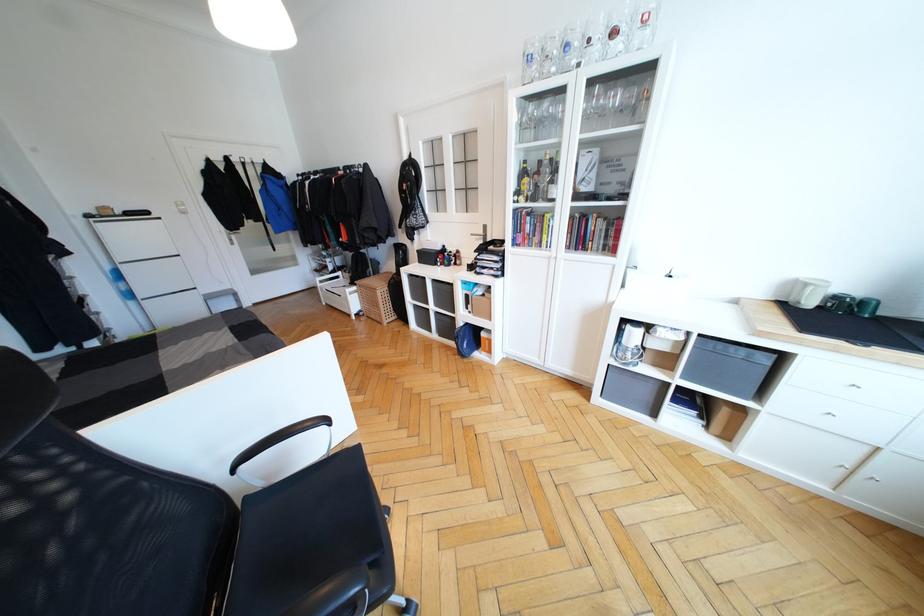
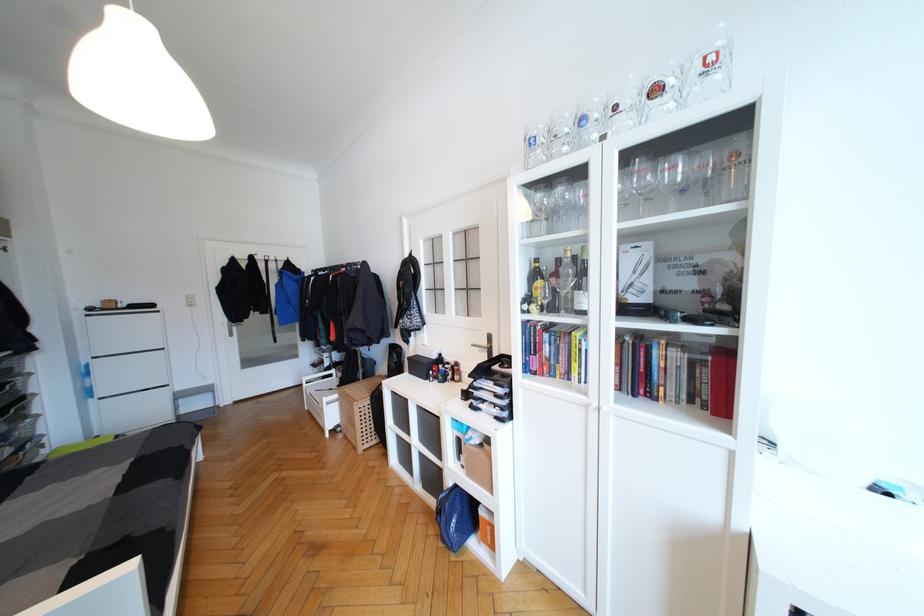
Locate, in the second image, the point that corresponds to (521,193) in the first image.

(531, 301)